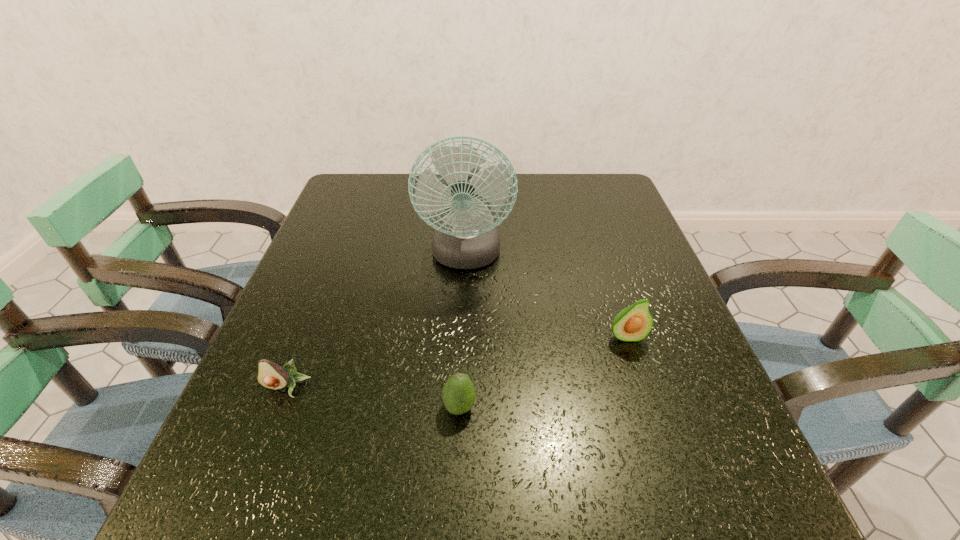
Where is `vacant area between the rightmost object and the leftmost avocado`? This screenshot has height=540, width=960. vacant area between the rightmost object and the leftmost avocado is located at coordinates (456, 362).

Locate an element on the screen. The width and height of the screenshot is (960, 540). unoccupied position between the leftmost object and the tallest object is located at coordinates (376, 322).

Locate an element on the screen. The image size is (960, 540). free space between the farthest avocado and the second avocado from right to left is located at coordinates (542, 372).

Image resolution: width=960 pixels, height=540 pixels. What are the coordinates of `vacant area that lies between the second avocado from right to left and the tallest object` in the screenshot? It's located at (463, 332).

Locate an element on the screen. The image size is (960, 540). free space between the farthest object and the leftmost avocado is located at coordinates (376, 322).

You are a GUI agent. You are given a task and a screenshot of the screen. Output one action in this format:
    pyautogui.click(x=<x>, y=<y>)
    Task: Click on the blank region between the leftmost object and the tallest avocado
    This screenshot has height=540, width=960.
    Given the screenshot: What is the action you would take?
    pyautogui.click(x=456, y=362)

Locate an element on the screen. The image size is (960, 540). unoccupied position between the second avocado from left to right and the leftmost object is located at coordinates (373, 397).

At what (x,y) coordinates should I click in order to perform the action: click on empty space between the second avocado from right to left and the farthest object. Please return your answer as a coordinate pair (x, y). The image size is (960, 540). Looking at the image, I should click on (463, 332).

Locate an element on the screen. free spot between the second avocado from left to right and the farthest object is located at coordinates (463, 332).

Locate an element on the screen. The image size is (960, 540). object that is the second nearest to the fan is located at coordinates (458, 394).